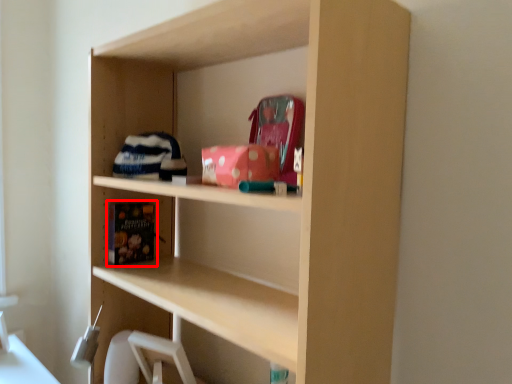
Question: Where is book (annotated by the red box) located in relation to book in the image?

Choices:
 (A) right
 (B) left

Answer: (B)